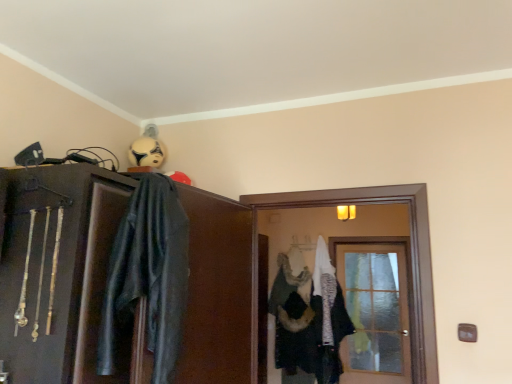
Question: Is white matte helmet at upper center bigger or smaller than fur-like fabric hanger at center?

Choices:
 (A) big
 (B) small

Answer: (B)

Question: Considering the positions of white matte helmet at upper center and fur-like fabric hanger at center in the image, is white matte helmet at upper center wider or thinner than fur-like fabric hanger at center?

Choices:
 (A) wide
 (B) thin

Answer: (A)

Question: Estimate the real-world distances between objects in this image. Which object is closer to the fur-like fabric hanger at center?

Choices:
 (A) matte black cabinet at upper left
 (B) translucent glass door at center
 (C) clear glass door at center
 (D) white matte helmet at upper center
 (E) white fuzzy coat at center

Answer: (E)

Question: Which is farther from the dark gray leather jacket at upper left?

Choices:
 (A) white fuzzy coat at center
 (B) translucent glass door at center
 (C) white matte helmet at upper center
 (D) fur-like fabric hanger at center
 (E) matte black cabinet at upper left

Answer: (D)